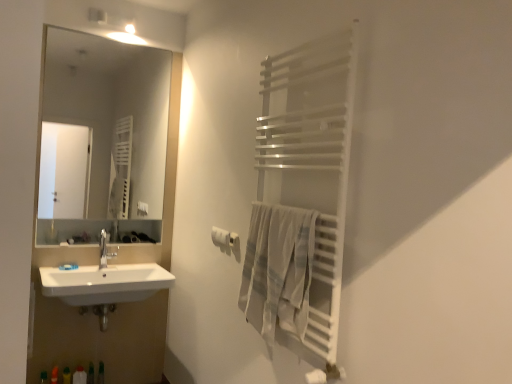
Question: Is light gray woven towel at right next to white plastic bottle at lower left, which appears as the first toiletry when viewed from the left, and touching it?

Choices:
 (A) yes
 (B) no

Answer: (B)

Question: From the image's perspective, is light gray woven towel at right below white plastic bottle at lower left, which appears as the first toiletry when viewed from the left?

Choices:
 (A) yes
 (B) no

Answer: (B)

Question: Is light gray woven towel at right turned away from white plastic bottle at lower left, which ranks as the second toiletry in right-to-left order?

Choices:
 (A) no
 (B) yes

Answer: (A)

Question: Is light gray woven towel at right far from white plastic bottle at lower left, which ranks as the second toiletry in right-to-left order?

Choices:
 (A) yes
 (B) no

Answer: (A)

Question: Is light gray woven towel at right aimed at white plastic bottle at lower left, which ranks as the second toiletry in right-to-left order?

Choices:
 (A) yes
 (B) no

Answer: (B)

Question: Do you think satin nickel faucet at sink left is within white matte towel bar at upper right, or outside of it?

Choices:
 (A) inside
 (B) outside

Answer: (B)

Question: Is satin nickel faucet at sink left in front of or behind white matte towel bar at upper right in the image?

Choices:
 (A) behind
 (B) front

Answer: (A)

Question: From a real-world perspective, is satin nickel faucet at sink left physically located above or below white matte towel bar at upper right?

Choices:
 (A) above
 (B) below

Answer: (B)

Question: Considering the positions of satin nickel faucet at sink left and white matte towel bar at upper right in the image, is satin nickel faucet at sink left wider or thinner than white matte towel bar at upper right?

Choices:
 (A) thin
 (B) wide

Answer: (B)

Question: Would you say white matte towel bar at upper right is inside or outside white matte toilet paper at center?

Choices:
 (A) outside
 (B) inside

Answer: (A)

Question: Based on their sizes in the image, would you say white matte towel bar at upper right is bigger or smaller than white matte toilet paper at center?

Choices:
 (A) big
 (B) small

Answer: (B)

Question: From a real-world perspective, is white matte towel bar at upper right positioned above or below white matte toilet paper at center?

Choices:
 (A) below
 (B) above

Answer: (B)

Question: Visually, is white matte towel bar at upper right positioned to the left or to the right of white matte toilet paper at center?

Choices:
 (A) right
 (B) left

Answer: (A)

Question: From the image's perspective, is white metallic towel rack at right located above or below white plastic bottle at lower left, which ranks as the second toiletry in right-to-left order?

Choices:
 (A) below
 (B) above

Answer: (B)

Question: From their relative heights in the image, would you say white metallic towel rack at right is taller or shorter than white plastic bottle at lower left, which appears as the first toiletry when viewed from the left?

Choices:
 (A) short
 (B) tall

Answer: (B)